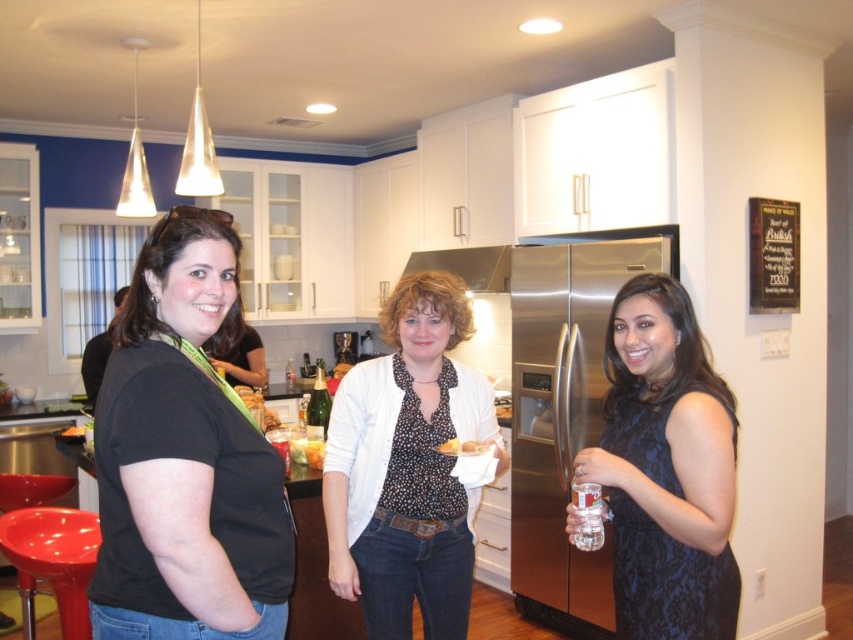
Measure the distance between point (347, 404) and camera.

Point (347, 404) and camera are 2.07 meters apart from each other.

Does point (450, 604) come in front of point (245, 323)?

Yes, it is.

From the picture: Who is more distant from viewer, (323, 502) or (236, 371)?

Positioned behind is point (236, 371).

You are a GUI agent. You are given a task and a screenshot of the screen. Output one action in this format:
    pyautogui.click(x=<x>, y=<y>)
    Task: Click on the white textured sweater at center
    
    Given the screenshot: What is the action you would take?
    pyautogui.click(x=408, y=467)

Does white textured sweater at center appear over black lace dress at center?

No, white textured sweater at center is not above black lace dress at center.

Which is in front, point (344, 541) or point (648, 460)?

Point (648, 460) is more forward.

Where is `white textured sweater at center`? white textured sweater at center is located at coordinates (408, 467).

From the picture: Is black lace dress at center positioned in front of translucent glass wine at center?

Yes, it is in front of translucent glass wine at center.

Is black lace dress at center bigger than translucent glass wine at center?

Indeed, black lace dress at center has a larger size compared to translucent glass wine at center.

Between point (670, 595) and point (448, 438), which one is positioned behind?

The point (448, 438) is more distant.

Where is `black lace dress at center`? The image size is (853, 640). black lace dress at center is located at coordinates (666, 468).